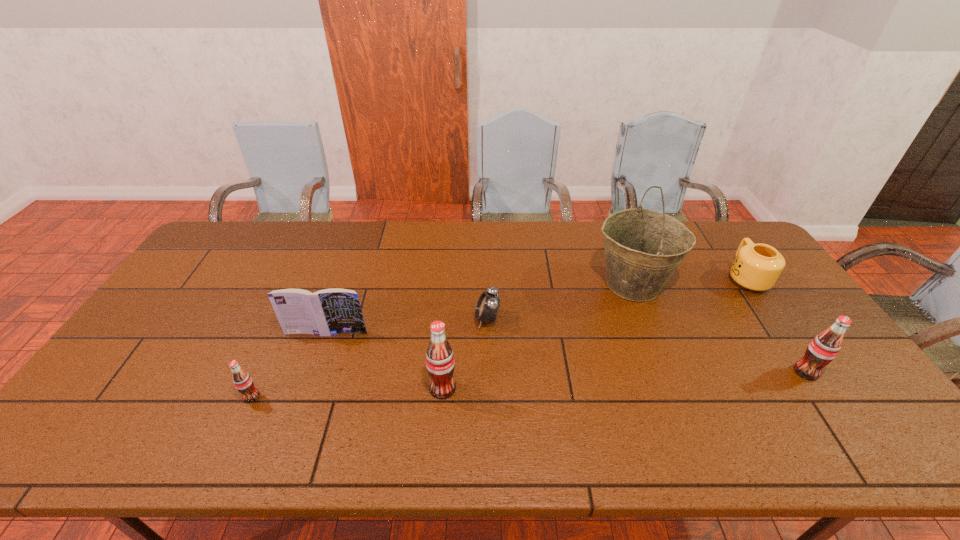
At what (x,y) coordinates should I click in order to perform the action: click on the shortest soda. Please return your answer as a coordinate pair (x, y). This screenshot has width=960, height=540. Looking at the image, I should click on pyautogui.click(x=243, y=382).

The image size is (960, 540). I want to click on the second soda from left to right, so click(440, 362).

This screenshot has width=960, height=540. I want to click on the rightmost soda, so click(x=825, y=346).

Where is `the fifth shortest object`? the fifth shortest object is located at coordinates (825, 346).

Find the location of a particular element. This screenshot has width=960, height=540. the fifth object from left to right is located at coordinates (643, 247).

The height and width of the screenshot is (540, 960). What are the coordinates of `wine bucket` in the screenshot? It's located at (643, 247).

This screenshot has height=540, width=960. Find the location of `the fourth object from right to left`. the fourth object from right to left is located at coordinates (488, 304).

Locate an element on the screen. mug is located at coordinates (757, 267).

The height and width of the screenshot is (540, 960). I want to click on book, so click(x=326, y=312).

Where is `vacant space located on the right of the shortest soda`? vacant space located on the right of the shortest soda is located at coordinates (372, 397).